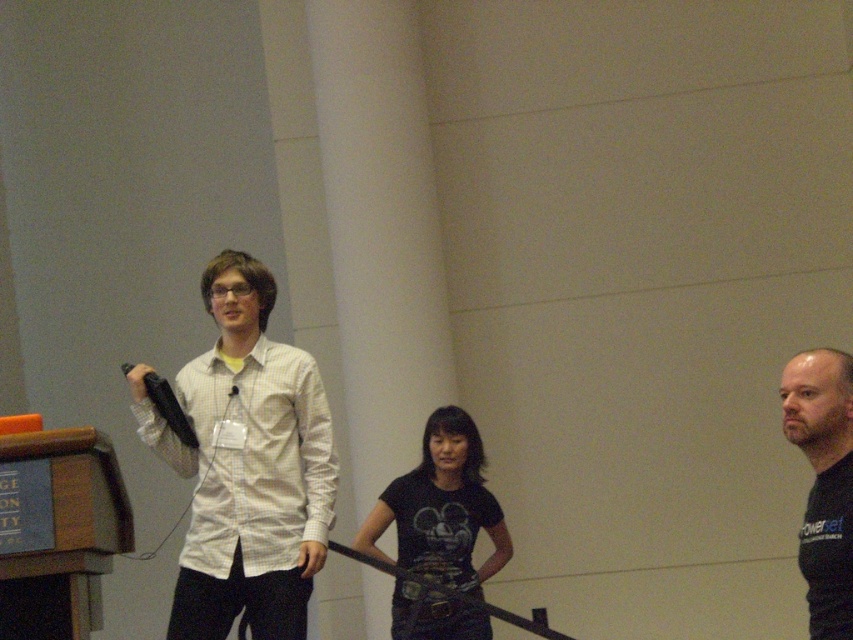
Based on the photo, you are standing in the conference room and need to hand a document to the person wearing the black matte shirt at center. Which direction should you move to reach them?

The black matte shirt at center is located at point (247, 465), so you should move towards the center of the room to reach them.